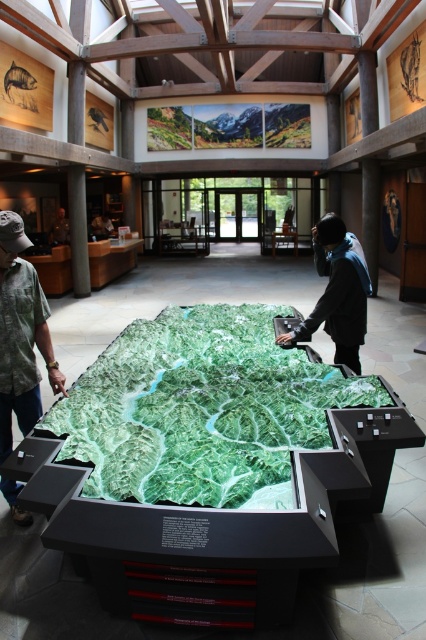
Question: Which point is farther to the camera?

Choices:
 (A) (0, 417)
 (B) (52, 240)

Answer: (B)

Question: Is dark gray jacket at center thinner than matte black person at left?

Choices:
 (A) no
 (B) yes

Answer: (A)

Question: From the image, what is the correct spatial relationship of green camouflage shirt at left in relation to dark gray jacket at center?

Choices:
 (A) below
 (B) above

Answer: (A)

Question: Can you confirm if green camouflage shirt at left is wider than dark gray jacket at center?

Choices:
 (A) no
 (B) yes

Answer: (A)

Question: Among these objects, which one is nearest to the camera?

Choices:
 (A) matte black person at left
 (B) green camouflage shirt at left

Answer: (B)

Question: Which point is closer to the camera?

Choices:
 (A) (68, 225)
 (B) (0, 272)

Answer: (B)